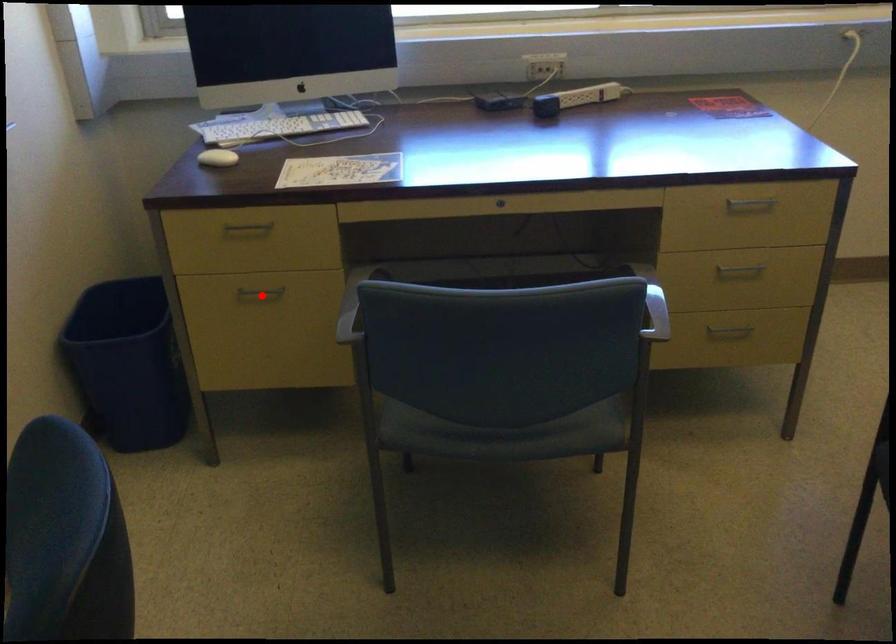
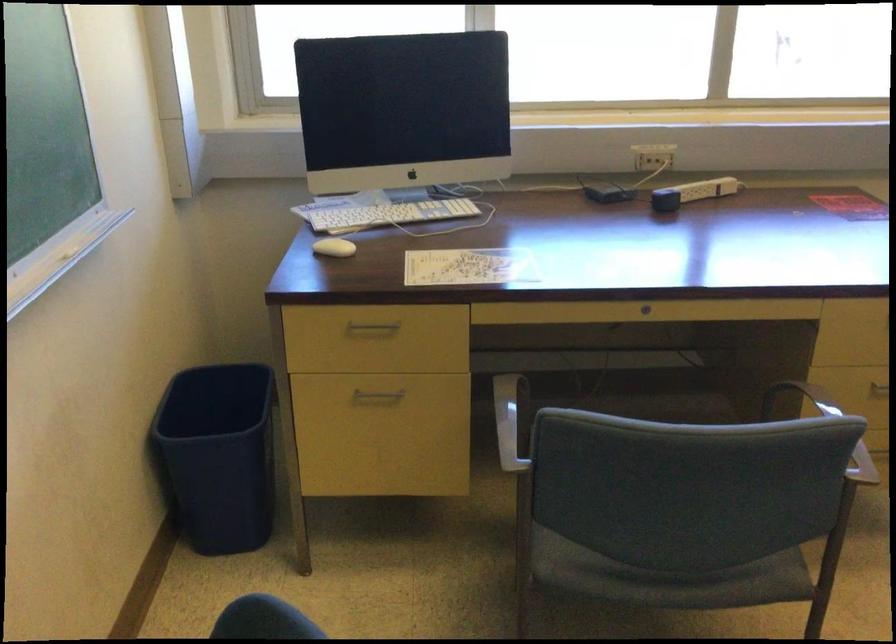
In the second image, find the point that corresponds to the highlighted location in the first image.

(376, 395)